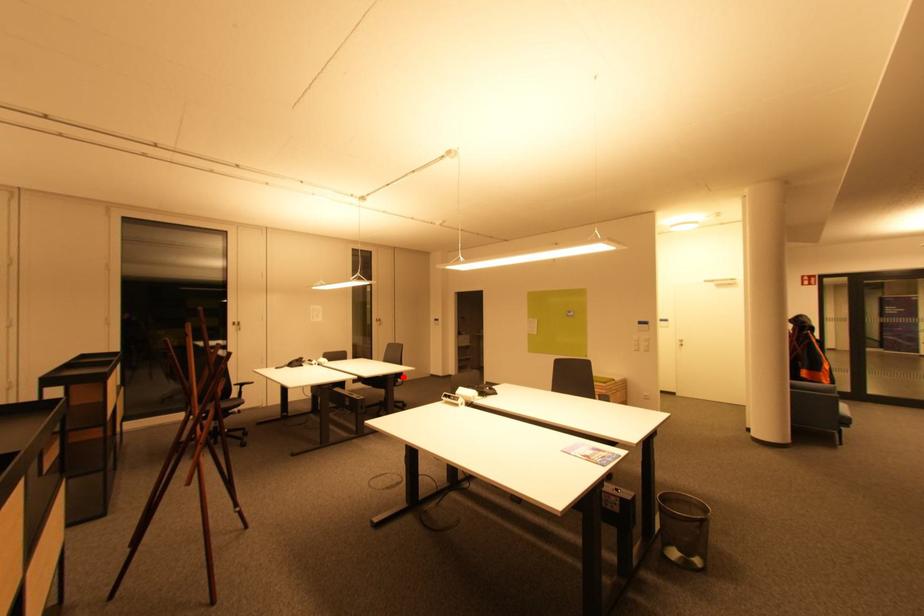
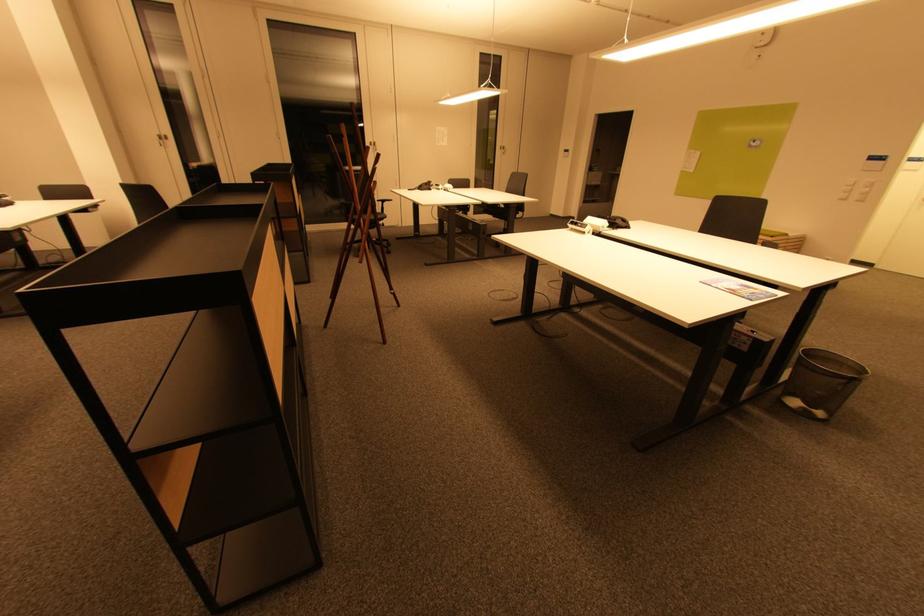
Where in the second image is the point corresponding to the highlighted location from the first image?

(525, 209)